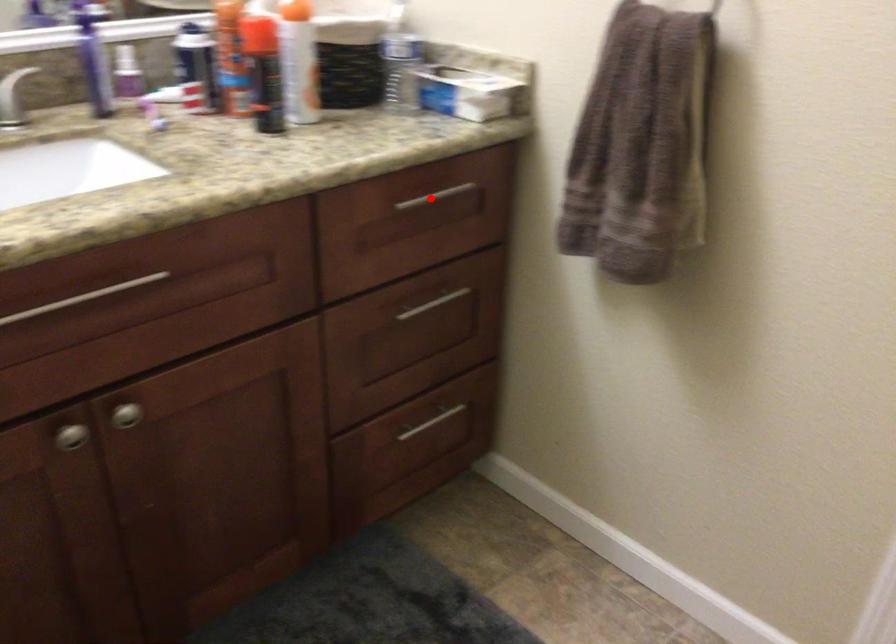
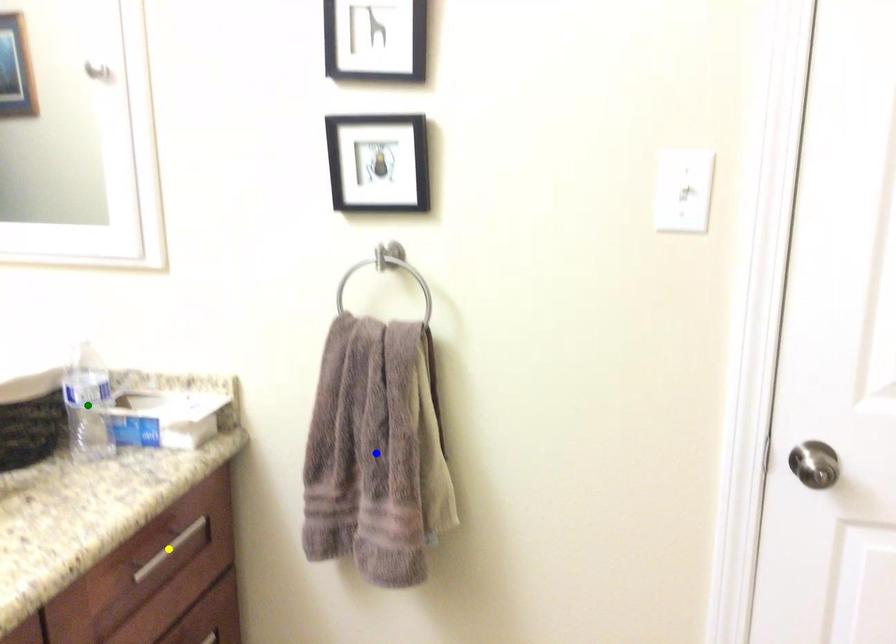
Question: I am providing you with two images of the same scene from different viewpoints. A red point is marked on the first image. You are given multiple points on the second image. Can you choose the point in image 2 that corresponds to the point in image 1?

Choices:
 (A) yellow point
 (B) green point
 (C) blue point

Answer: (A)